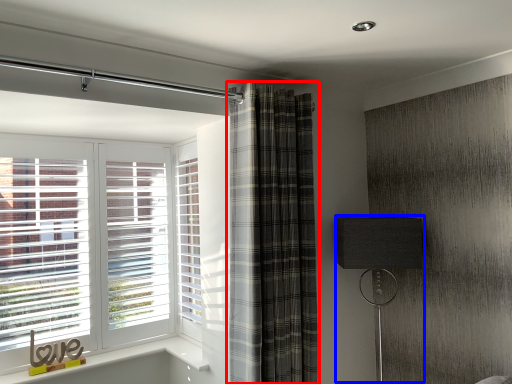
Question: Which object is further to the camera taking this photo, curtain (highlighted by a red box) or table lamp (highlighted by a blue box)?

Choices:
 (A) curtain
 (B) table lamp

Answer: (B)